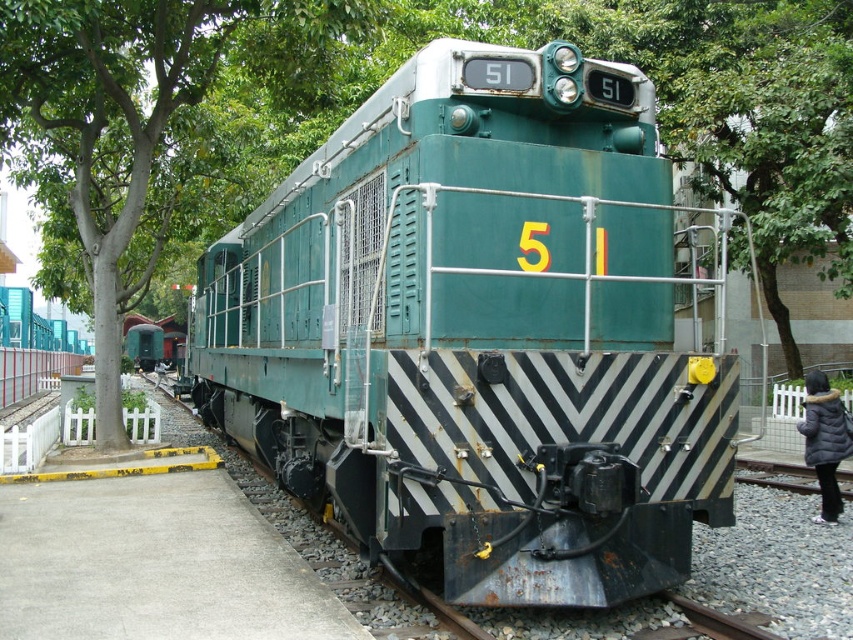
Based on the photo, measure the distance between green leafy tree at center and camera.

8.19 meters

Does green leafy tree at center appear under black leather jacket at center?

No, green leafy tree at center is not below black leather jacket at center.

Who is more distant from viewer, (370,29) or (160,371)?

Positioned behind is point (160,371).

What are the coordinates of `green leafy tree at center` in the screenshot? It's located at (376, 83).

Which is above, green matte train at center or dark gray down jacket at lower right?

green matte train at center is higher up.

Who is positioned more to the right, green matte train at center or dark gray down jacket at lower right?

dark gray down jacket at lower right is more to the right.

Between point (355, 234) and point (828, 403), which one is positioned behind?

The point (828, 403) is more distant.

Identify the location of green matte train at center. The width and height of the screenshot is (853, 640). (479, 332).

Is dark gray down jacket at lower right behind black leather jacket at center?

No, it is not.

Which is in front, point (810, 420) or point (155, 371)?

Point (810, 420)

Find the location of a particular element. This screenshot has height=640, width=853. dark gray down jacket at lower right is located at coordinates (824, 440).